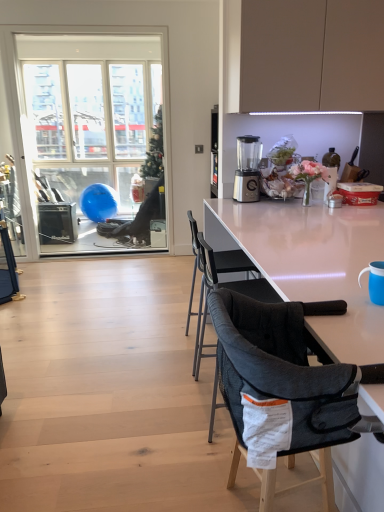
Question: In the image, is blue plastic cup at right on the left side or the right side of dark gray mesh chair at center, the 1th chair viewed from the front?

Choices:
 (A) right
 (B) left

Answer: (A)

Question: Considering the positions of blue plastic cup at right and dark gray mesh chair at center, the second chair viewed from the back, in the image, is blue plastic cup at right bigger or smaller than dark gray mesh chair at center, the second chair viewed from the back,?

Choices:
 (A) small
 (B) big

Answer: (A)

Question: Estimate the real-world distances between objects in this image. Which object is closer to the dark gray fabric chair at center, placed as the second chair when sorted from front to back?

Choices:
 (A) sleek silver blender at center
 (B) clear glass window at left
 (C) white glossy table at center
 (D) dark gray mesh chair at center, the second chair viewed from the back
 (E) blue plastic cup at right

Answer: (C)

Question: Which is nearer to the white glossy table at center?

Choices:
 (A) blue plastic cup at right
 (B) dark gray mesh chair at center, the 1th chair viewed from the front
 (C) clear glass window at left
 (D) sleek silver blender at center
 (E) dark gray fabric chair at center, the first chair from the back

Answer: (B)